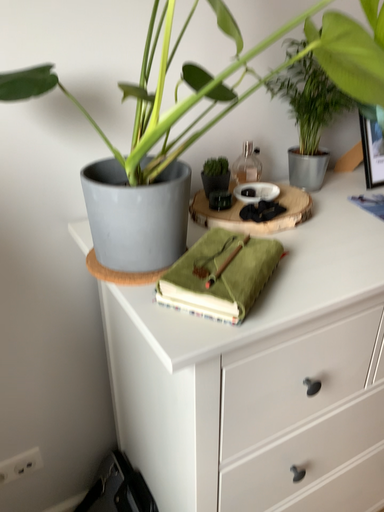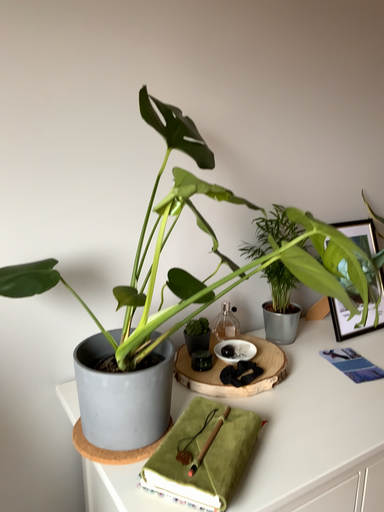
Question: How did the camera likely rotate when shooting the video?

Choices:
 (A) rotated upward
 (B) rotated downward

Answer: (A)